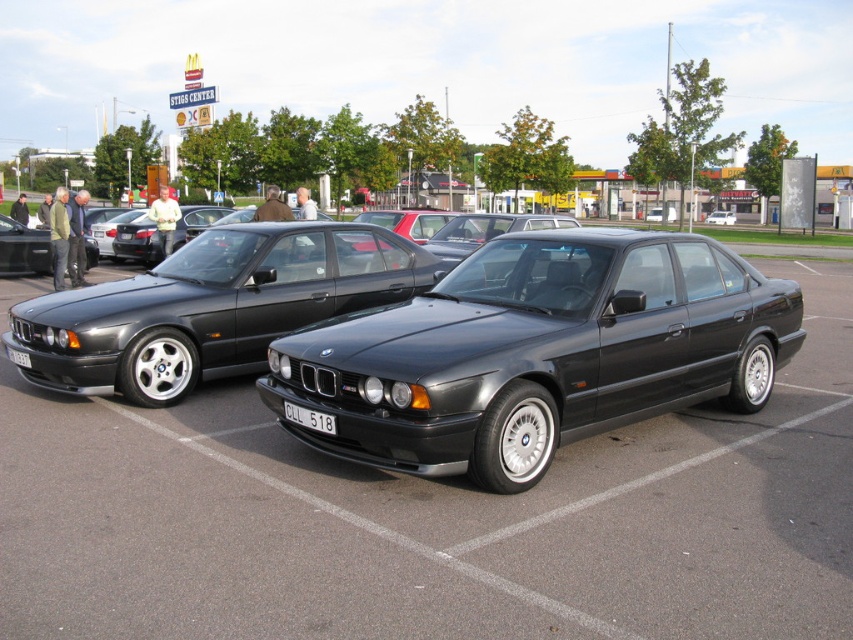
Is satin black car at center further to camera compared to white plastic license plate at lower left?

No, it is not.

Who is more forward, (x=181, y=541) or (x=18, y=358)?

Point (x=181, y=541) is in front.

Identify the location of satin black car at center. (433, 518).

Identify the location of satin black car at center. This screenshot has width=853, height=640. (433, 518).

Is point (811, 422) farther from viewer compared to point (44, 369)?

Yes, it is behind point (44, 369).

Who is more distant from viewer, (233, 378) or (189, 387)?

The point (233, 378) is more distant.

Where is `satin black car at center`? satin black car at center is located at coordinates (433, 518).

The width and height of the screenshot is (853, 640). Find the location of `matte black sedan at center`. matte black sedan at center is located at coordinates (537, 353).

Which of these two, matte black sedan at center or black plastic license plate at center, stands taller?

matte black sedan at center is taller.

Does point (534, 451) come farther from viewer compared to point (300, 412)?

No, it is in front of (300, 412).

The image size is (853, 640). In order to click on matte black sedan at center in this screenshot , I will do `click(537, 353)`.